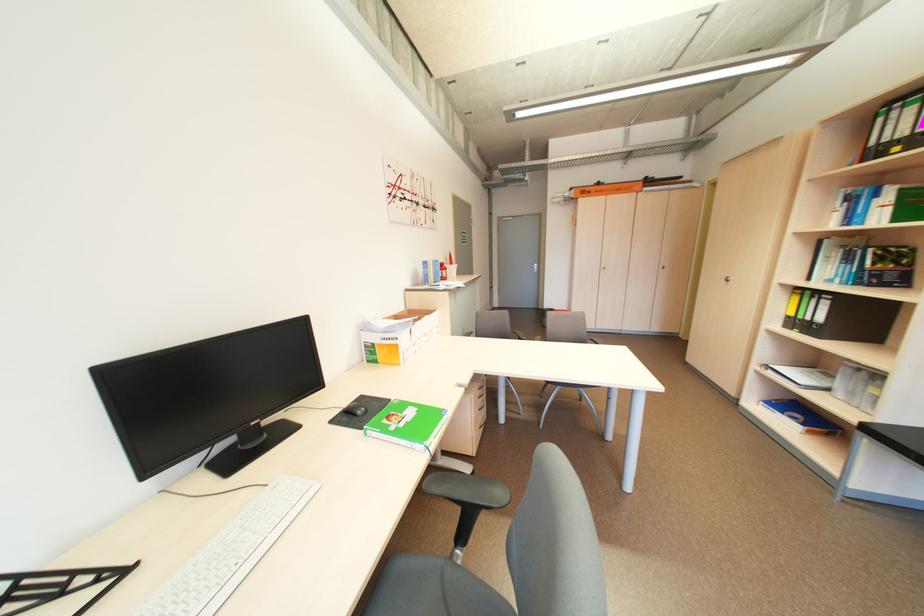
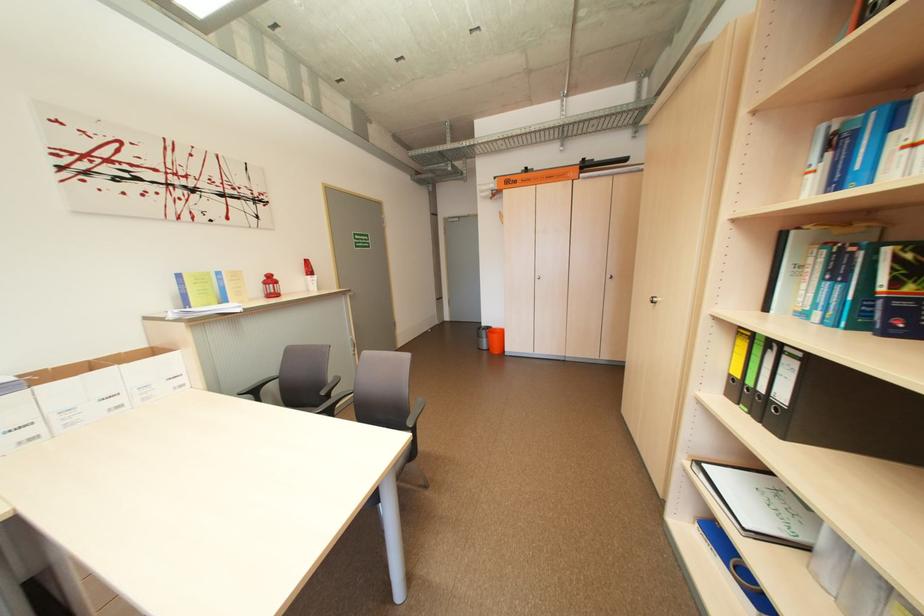
Where in the second image is the point corresponding to point (834, 302) from the first image?

(800, 363)